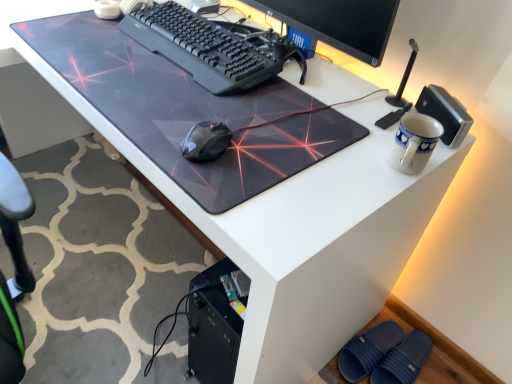
Identify the location of free location above transparent plastic mousepad at center (from a real-world perspective). This screenshot has width=512, height=384. (170, 74).